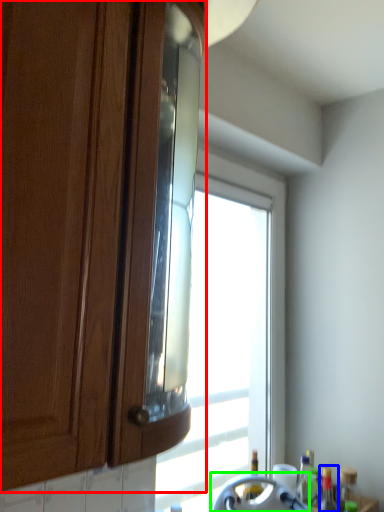
Question: Based on their relative distances, which object is nearer to cabinetry (highlighted by a red box)? Choose from bottle (highlighted by a blue box) and appliance (highlighted by a green box).

Choices:
 (A) bottle
 (B) appliance

Answer: (B)